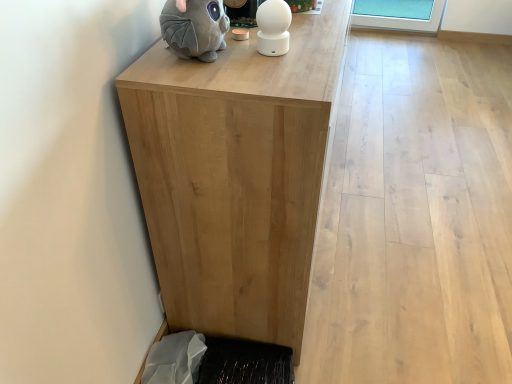
Locate an element on the screen. This screenshot has width=512, height=384. vacant area that lies between white glossy ball at upper center and gray plush toy at upper left is located at coordinates (250, 60).